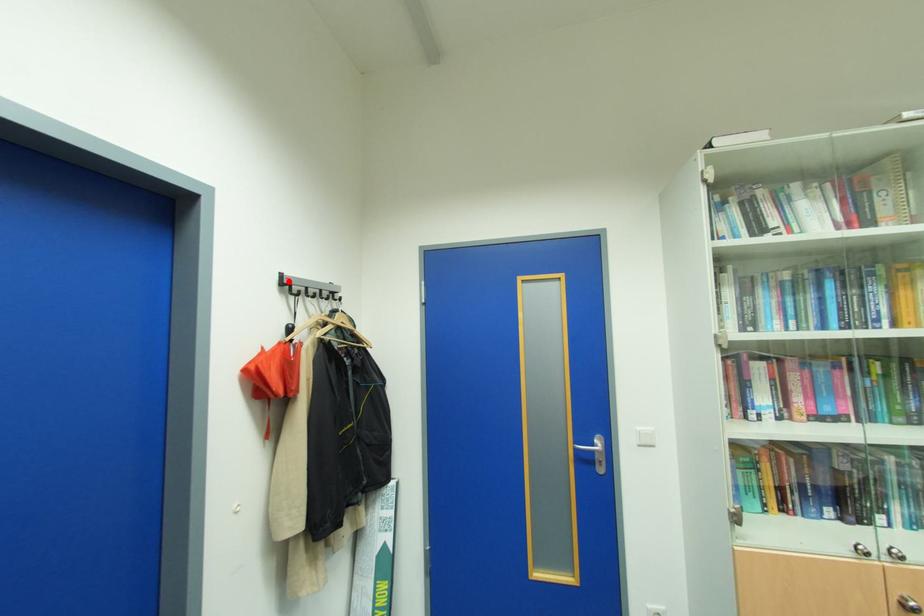
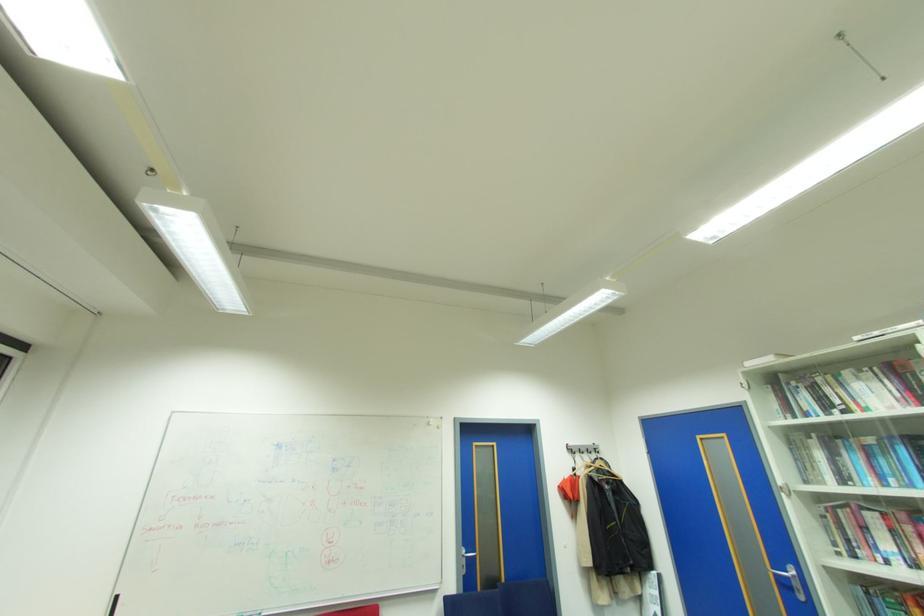
The point at the highlighted location is marked in the first image. Where is the corresponding point in the second image?

(573, 448)